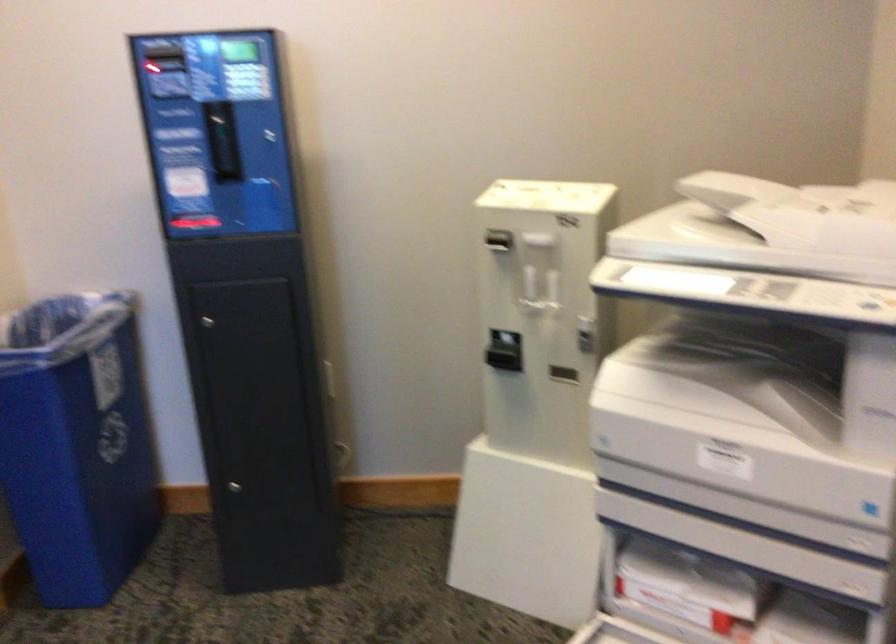
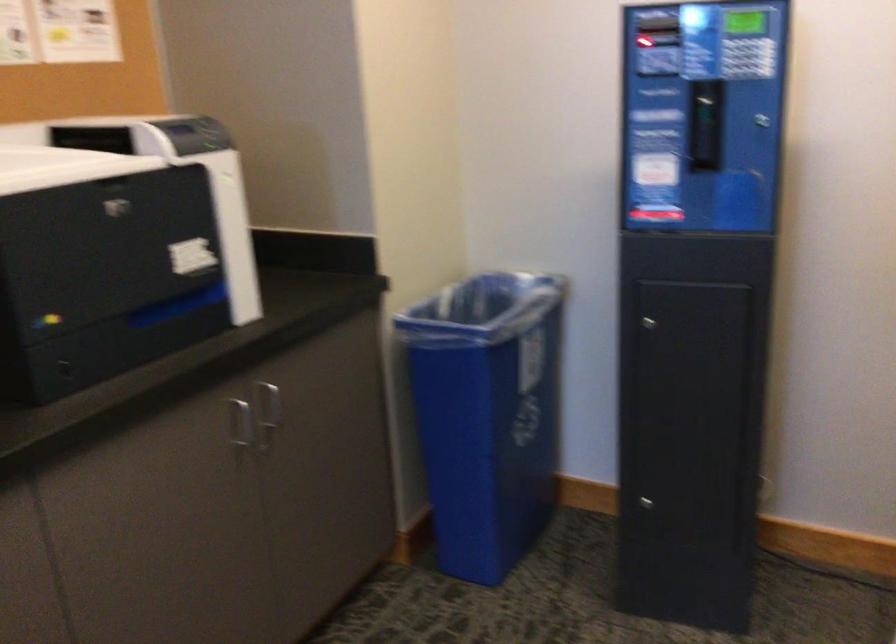
Where in the second image is the point corresponding to (239,486) from the first image?

(648, 504)